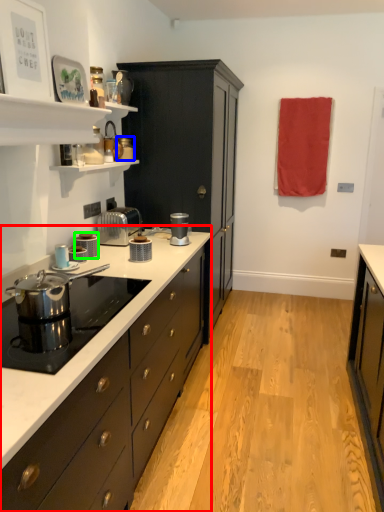
Question: Estimate the real-world distances between objects in this image. Which object is closer to countertop (highlighted by a red box), appliance (highlighted by a blue box) or kitchen appliance (highlighted by a green box)?

Choices:
 (A) appliance
 (B) kitchen appliance

Answer: (B)